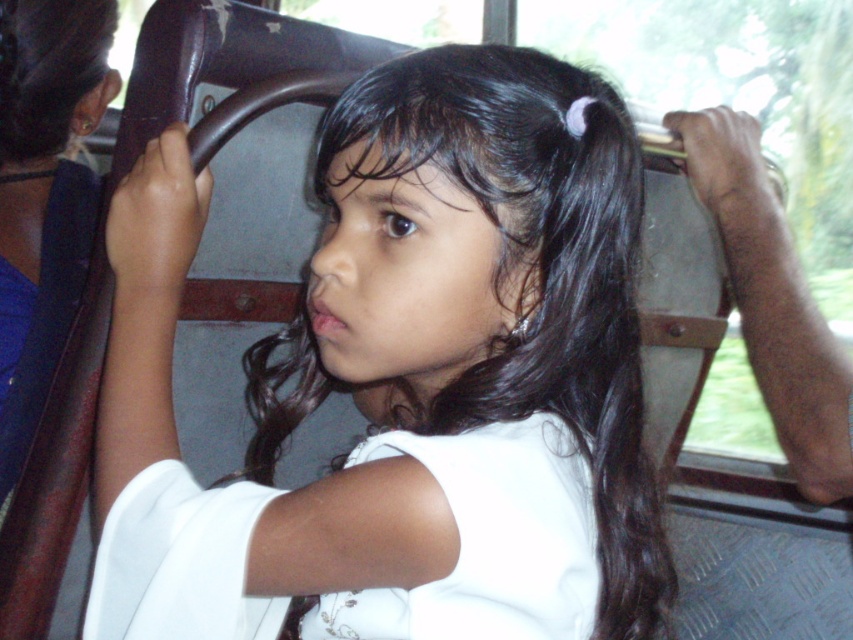
Question: Is black hair at center above metallic gray coach at right?

Choices:
 (A) no
 (B) yes

Answer: (A)

Question: Which point is closer to the camera?

Choices:
 (A) (459, 301)
 (B) (840, 410)

Answer: (A)

Question: Observing the image, what is the correct spatial positioning of black hair at center in reference to metallic gray coach at right?

Choices:
 (A) above
 (B) below

Answer: (B)

Question: Which point is closer to the camera taking this photo?

Choices:
 (A) (421, 429)
 (B) (749, 221)

Answer: (A)

Question: Is black hair at center positioned at the back of metallic gray coach at right?

Choices:
 (A) yes
 (B) no

Answer: (B)